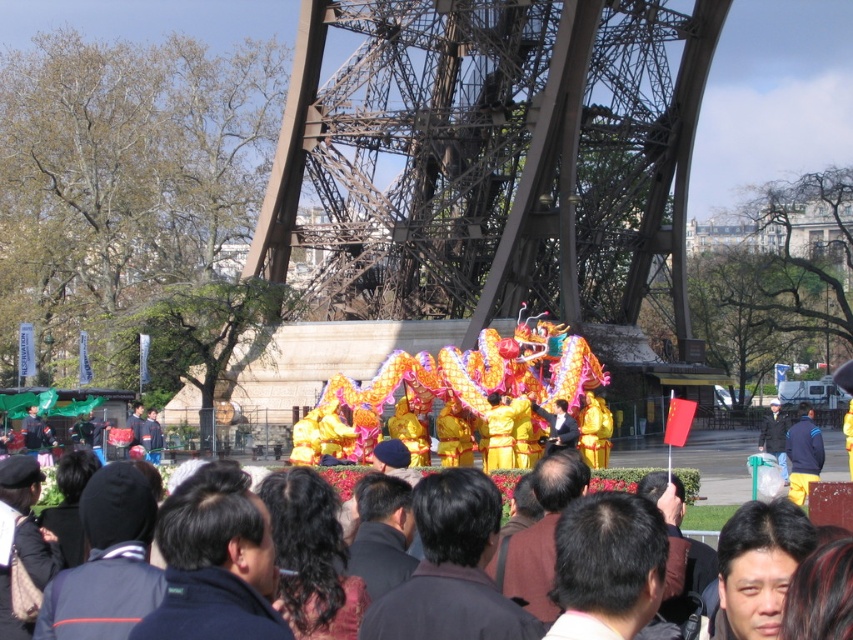
Question: Among these objects, which one is farthest from the camera?

Choices:
 (A) yellow satin dragon at center
 (B) metallic brown eiffel tower at center

Answer: (B)

Question: Which point appears farthest from the camera in this image?

Choices:
 (A) pyautogui.click(x=323, y=234)
 (B) pyautogui.click(x=311, y=412)

Answer: (A)

Question: Does metallic brown eiffel tower at center appear under yellow satin dragon at center?

Choices:
 (A) yes
 (B) no

Answer: (B)

Question: Is metallic brown eiffel tower at center further to the viewer compared to yellow satin dragon at center?

Choices:
 (A) yes
 (B) no

Answer: (A)

Question: Does metallic brown eiffel tower at center appear on the left side of yellow satin dragon at center?

Choices:
 (A) no
 (B) yes

Answer: (A)